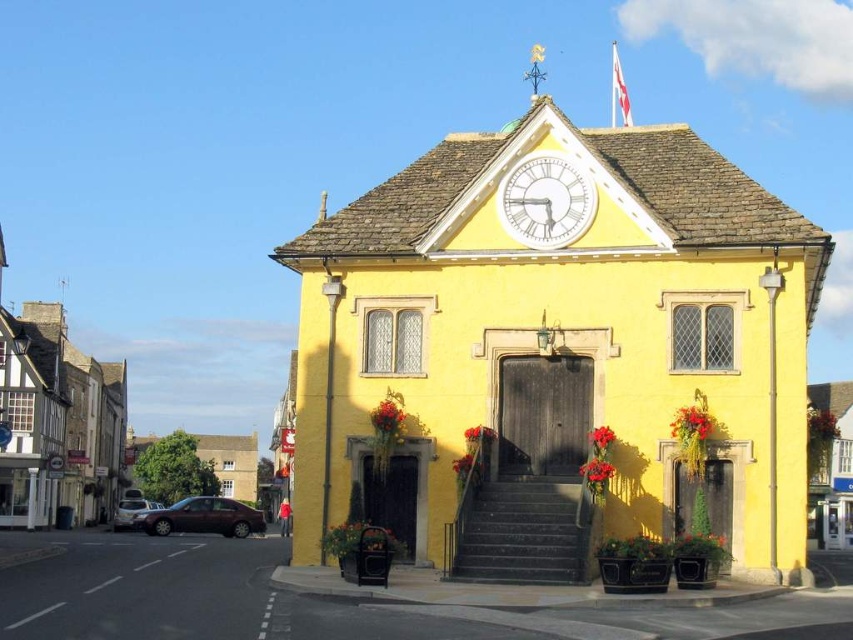
In the scene shown: You are standing in front of the yellow building and want to enter through the central door. Which object must you pass under as you walk up the dark gray stone stairs at center towards the white glass clock at upper center?

The dark gray stone stairs at center are positioned under the white glass clock at upper center, so you must pass under the white glass clock at upper center as you walk up the stairs.

You are standing in a village square and see the yellow stone church at center. If you want to take a photo of it from a distance of 50 meters, should you move closer or farther away?

The yellow stone church at center is currently 47.19 meters away from you. To achieve a distance of 50 meters, you need to move farther away from the church.